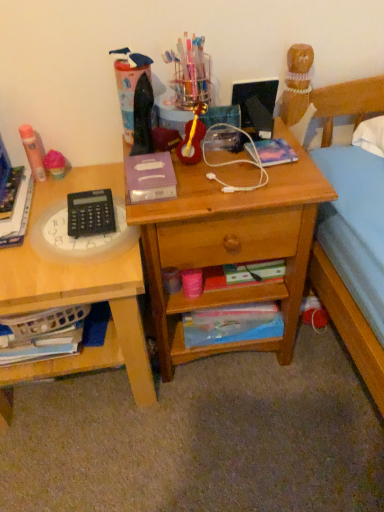
Where is `free location above wooden desk at center (from a real-world perspective)`? free location above wooden desk at center (from a real-world perspective) is located at coordinates (218, 164).